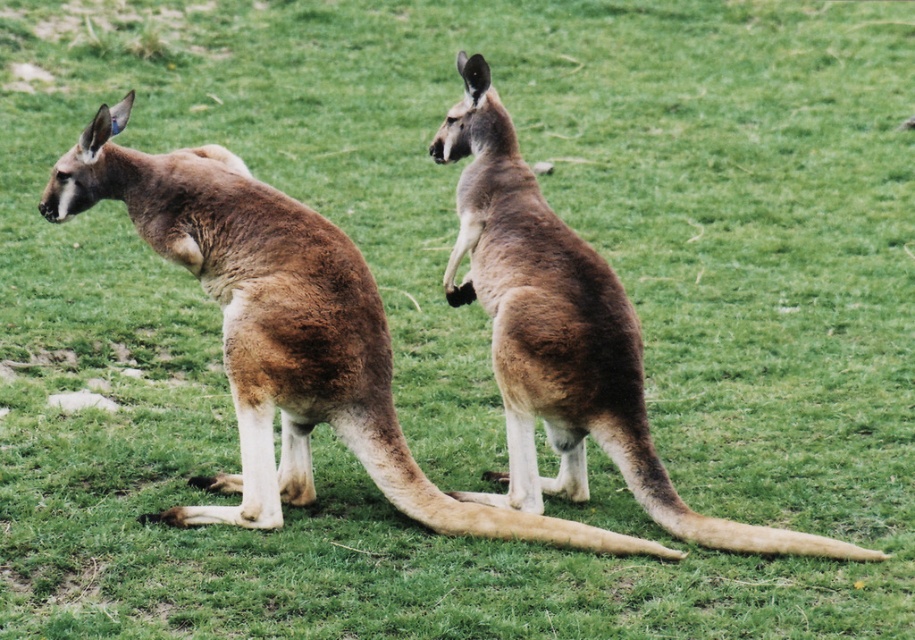
You are a wildlife photographer aiming to capture a photo of both brown furry kangaroo at left and brown furry kangaroo at center. Since you want to ensure both are clearly visible, which kangaroo should you focus on first to account for their sizes?

The brown furry kangaroo at left is shorter than the brown furry kangaroo at center. Therefore, you should focus on the brown furry kangaroo at center first as it is taller and might require more attention to ensure clarity in the photo.

You are a photographer trying to capture both kangaroos in a single shot. Since you want to include both brown furry kangaroo at left and brown furry kangaroo at center, which kangaroo should you position closer to the left side of your camera frame?

The brown furry kangaroo at left should be positioned closer to the left side of your camera frame because it is already on the left side of the brown furry kangaroo at center.